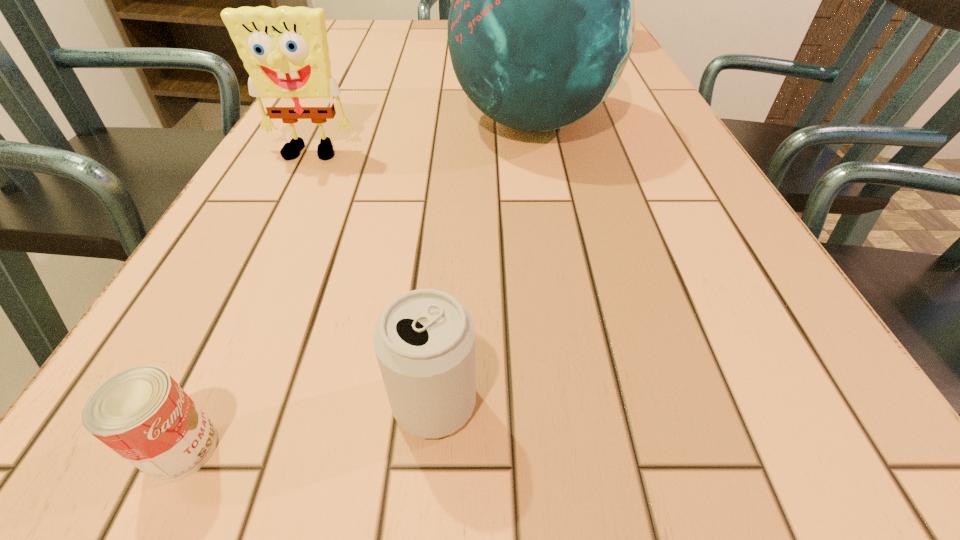
Find the location of a particular element. This screenshot has width=960, height=540. object that is the second closest to the shortest object is located at coordinates (285, 51).

The height and width of the screenshot is (540, 960). I want to click on vacant space that satisfies the following two spatial constraints: 1. on the back side of the taller can; 2. on the right side of the globe, so point(456,122).

Find the location of a particular element. vacant space that satisfies the following two spatial constraints: 1. on the face of the third tallest object; 2. on the left side of the sponge is located at coordinates (183, 403).

Where is `free region that satisfies the following two spatial constraints: 1. on the face of the right can; 2. on the right side of the third shortest object`? The width and height of the screenshot is (960, 540). free region that satisfies the following two spatial constraints: 1. on the face of the right can; 2. on the right side of the third shortest object is located at coordinates (183, 403).